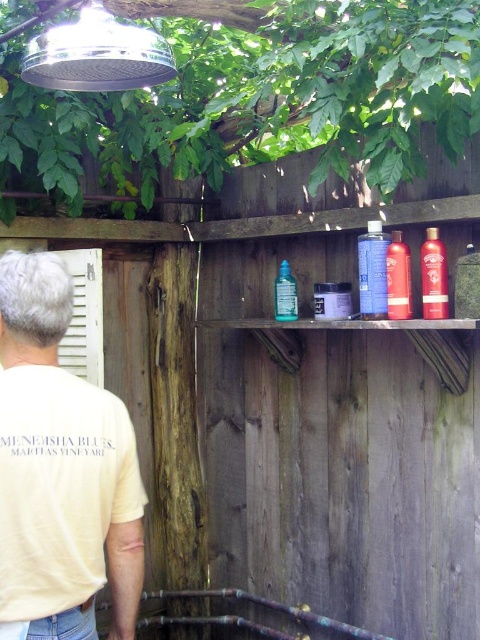
You are organizing a beauty event and need to place two items on a narrow shelf. The red matte hair spray at upper center and the translucent glass bottle at center must be placed side by side. Considering their widths, will they fit if the shelf is only 15 cm wide?

The red matte hair spray at upper center has a lesser width compared to the translucent glass bottle at center. However, without knowing the exact widths of both items, it is impossible to determine if their combined width will exceed the 15 cm shelf space. Additional measurements are needed.

You are standing in front of the outdoor shower setup. There are two points marked on the wooden fence. The first point is at coordinates point (x=24, y=324) and the second point is at point (x=285, y=262). Which point is closer to you?

Point (x=24, y=324) is in front of point (x=285, y=262), so the first point is closer to you.